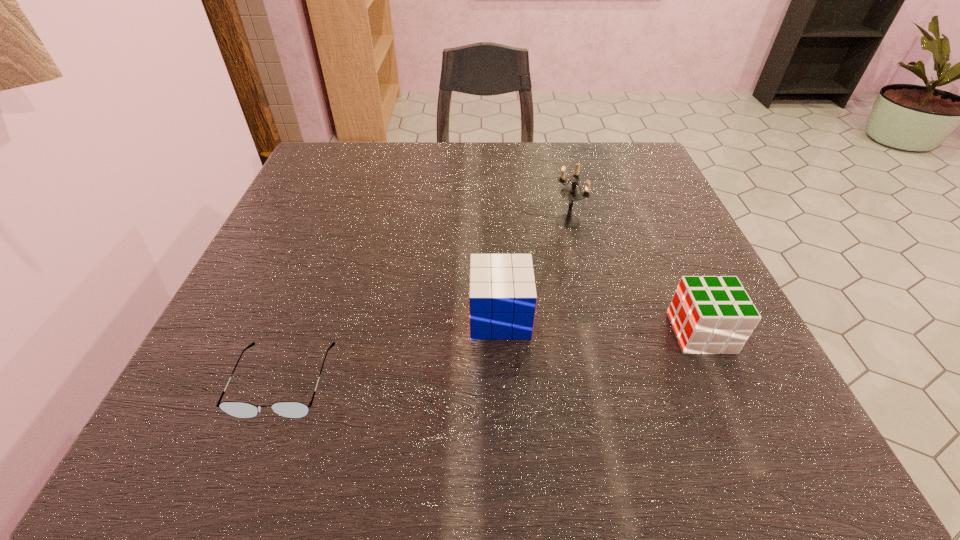
I want to click on unoccupied area between the rightmost object and the left cube, so click(600, 325).

The image size is (960, 540). Identify the location of vacant space in between the tallest object and the right cube. (635, 277).

This screenshot has height=540, width=960. In order to click on free space between the rightmost object and the left cube in this screenshot , I will do `click(600, 325)`.

This screenshot has width=960, height=540. Find the location of `free space between the third object from right to left and the farthest object`. free space between the third object from right to left and the farthest object is located at coordinates (534, 269).

At what (x,y) coordinates should I click in order to perform the action: click on vacant area that lies between the shortest object and the rightmost object. Please return your answer as a coordinate pair (x, y). The width and height of the screenshot is (960, 540). Looking at the image, I should click on (492, 357).

You are a GUI agent. You are given a task and a screenshot of the screen. Output one action in this format:
    pyautogui.click(x=<x>, y=<y>)
    Task: Click on the empty space between the left cube and the tallest object
    
    Given the screenshot: What is the action you would take?
    pyautogui.click(x=534, y=269)

You are a GUI agent. You are given a task and a screenshot of the screen. Output one action in this format:
    pyautogui.click(x=<x>, y=<y>)
    Task: Click on the free space between the leftmost object and the candle holder
    The image size is (960, 540).
    Given the screenshot: What is the action you would take?
    pyautogui.click(x=426, y=301)

Identify the location of free space between the rightmost object and the third object from right to left. The image size is (960, 540). (600, 325).

Identify the location of empty space that is in between the third object from left to right and the right cube. Image resolution: width=960 pixels, height=540 pixels. (635, 277).

This screenshot has height=540, width=960. Find the location of `unoccupied area between the second object from left to right and the leftmost object`. unoccupied area between the second object from left to right and the leftmost object is located at coordinates (x=392, y=349).